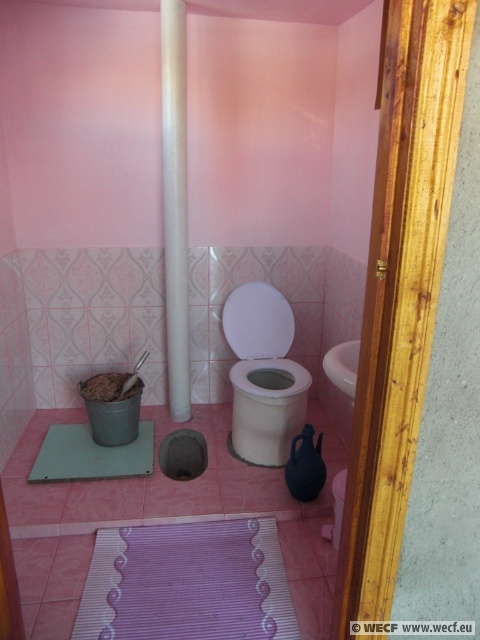
Question: Among these objects, which one is farthest from the camera?

Choices:
 (A) green rubber bath mat at lower center
 (B) white glossy toilet bowl at center

Answer: (B)

Question: Which point is farther to the camera?

Choices:
 (A) white glossy pipe at center
 (B) white glossy toilet bowl at center

Answer: (B)

Question: Does purple striped bath mat at lower center appear on the right side of white glossy toilet bowl at center?

Choices:
 (A) yes
 (B) no

Answer: (B)

Question: Does white glossy toilet bowl at center have a greater width compared to green rubber bath mat at lower center?

Choices:
 (A) no
 (B) yes

Answer: (A)

Question: From the image, what is the correct spatial relationship of purple striped bath mat at lower center in relation to white glossy pipe at center?

Choices:
 (A) above
 (B) below

Answer: (B)

Question: Which object appears farthest from the camera in this image?

Choices:
 (A) green rubber bath mat at lower center
 (B) purple striped bath mat at lower center

Answer: (A)